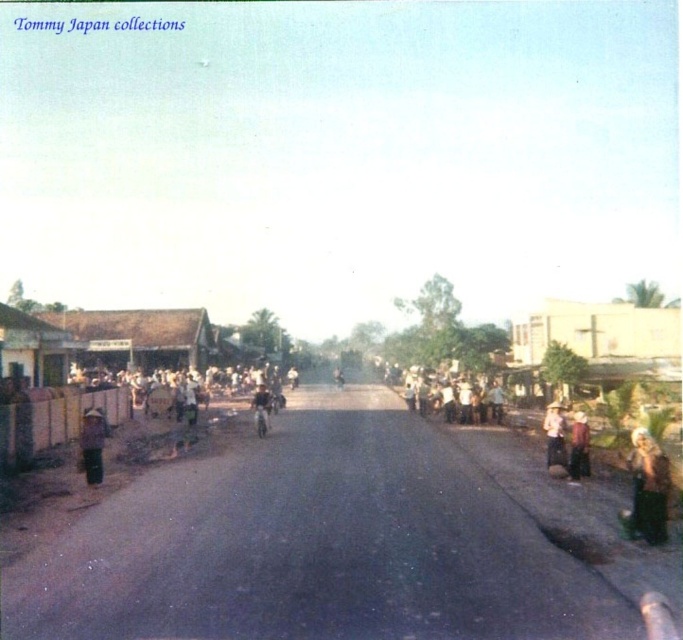
You are standing at the center of the road in the village scene. You see a point marked at coordinates (92, 444). Which object is this point located on?

The point is located on the light brown straw hat at left.

You are a fashion photographer who wants to capture a photo of the brown fabric dress at right and the light brown leather jacket at center. Since you can only focus on one subject at a time, which one should you choose to ensure the other is still in the background of the photo?

To have the light brown leather jacket at center in the background, focus on the brown fabric dress at right. Since the brown fabric dress at right is to the right of the light brown leather jacket at center, positioning the camera to focus on the dress would place the jacket behind it in the frame.

You are a delivery person carrying a package that needs to be placed between the brown fabric dress at right and the light brown leather jacket at center. The package is 3 feet long. Can you fit it between them without moving either clothing item?

The distance between the brown fabric dress at right and the light brown leather jacket at center is 37.69 feet, which is more than enough to fit a 3 feet long package between them without moving either clothing item.